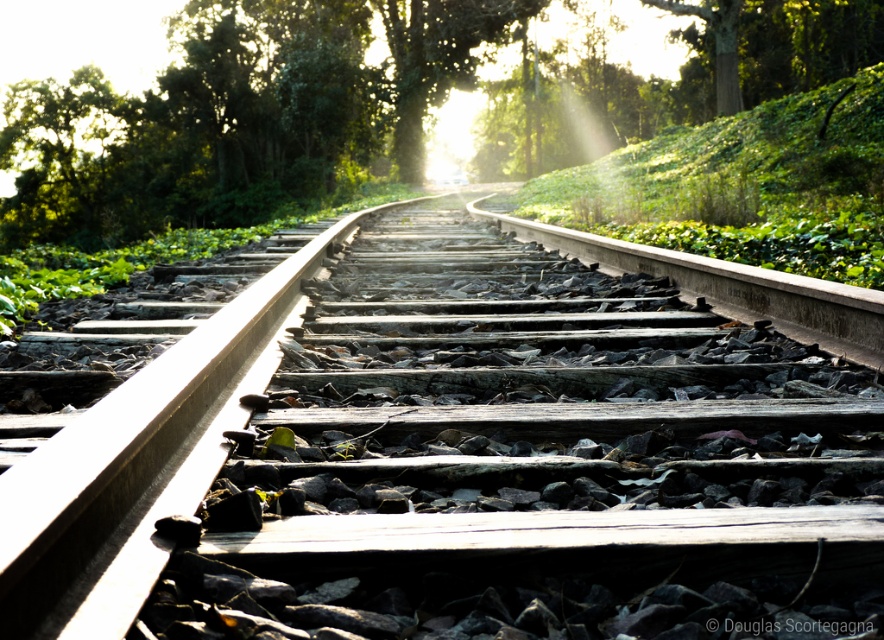
Question: Does wooden track at center appear over green leafy tree at center?

Choices:
 (A) yes
 (B) no

Answer: (B)

Question: Does wooden track at center have a smaller size compared to green leafy tree at center?

Choices:
 (A) yes
 (B) no

Answer: (A)

Question: Does wooden track at center appear on the right side of green leafy tree at center?

Choices:
 (A) yes
 (B) no

Answer: (A)

Question: Which object appears farthest from the camera in this image?

Choices:
 (A) wooden track at center
 (B) green leafy tree at center

Answer: (B)